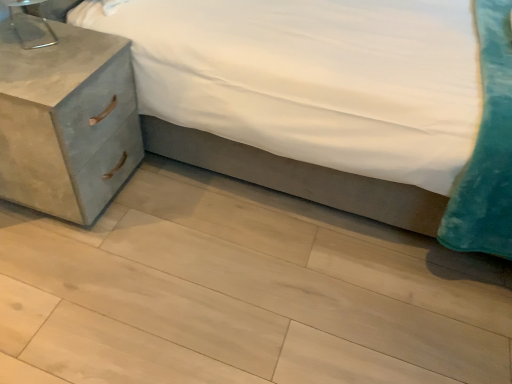
Identify the location of vacant area that is in front of matte concrete nightstand at left. (58, 266).